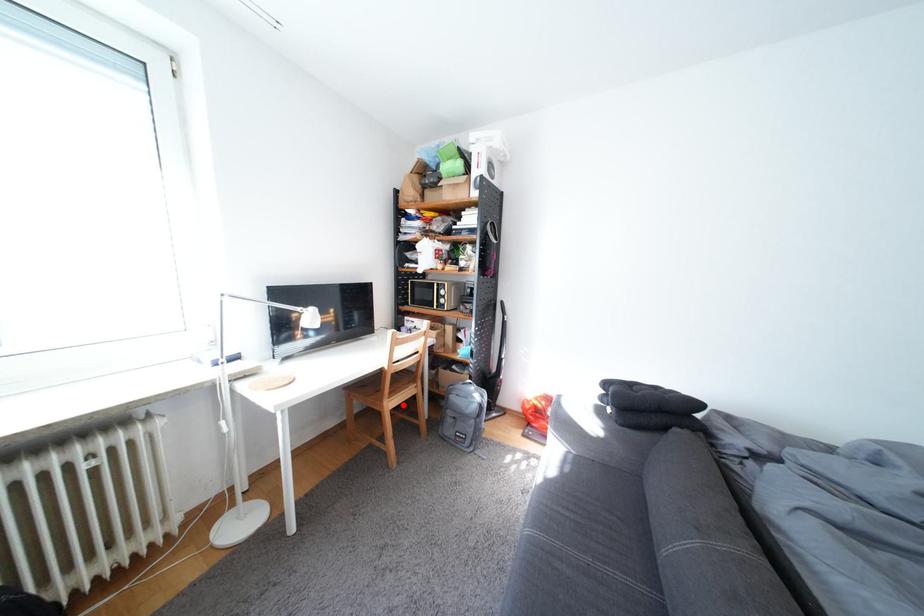
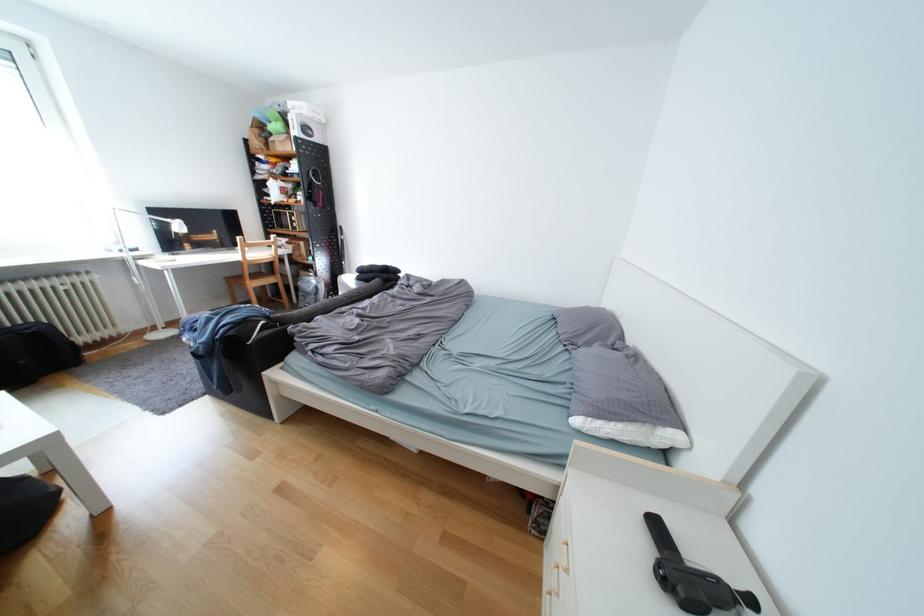
Locate, in the second image, the point that corresponds to the highlighted location in the first image.

(265, 285)